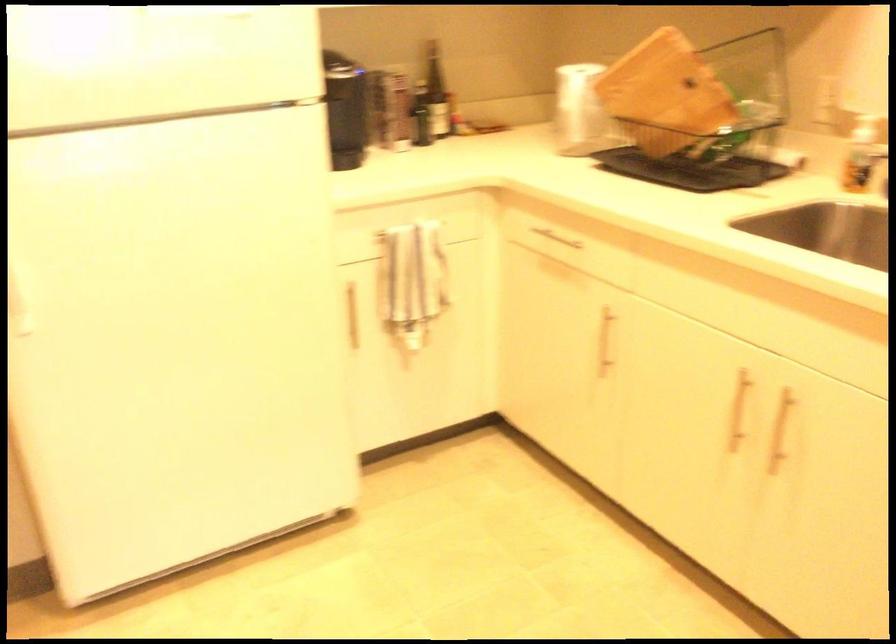
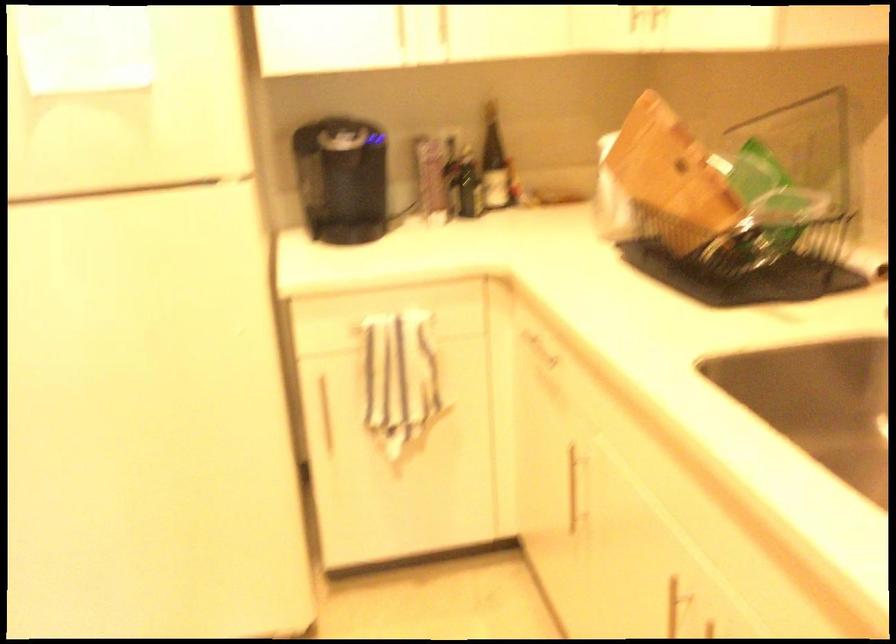
In the second image, find the point that corresponds to [596,339] in the first image.

(576, 486)